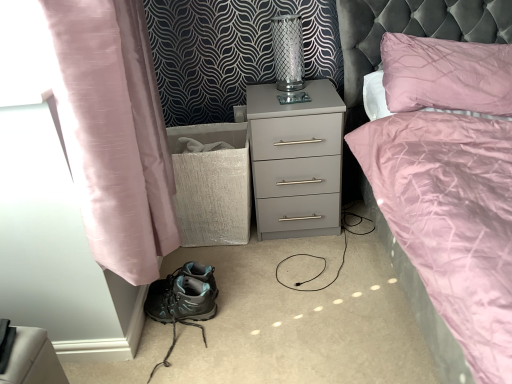
Question: Considering the positions of clear glass vase at upper center and matte gray nightstand at center in the image, is clear glass vase at upper center wider or thinner than matte gray nightstand at center?

Choices:
 (A) wide
 (B) thin

Answer: (B)

Question: From the image's perspective, relative to matte gray nightstand at center, is clear glass vase at upper center above or below?

Choices:
 (A) below
 (B) above

Answer: (B)

Question: Based on their relative distances, which object is nearer to the matte gray nightstand at center?

Choices:
 (A) teal fabric hiking boots at lower left
 (B) pink silk curtain at left
 (C) clear glass vase at upper center

Answer: (C)

Question: Which object is the farthest from the teal fabric hiking boots at lower left?

Choices:
 (A) clear glass vase at upper center
 (B) pink silk curtain at left
 (C) matte gray nightstand at center

Answer: (A)